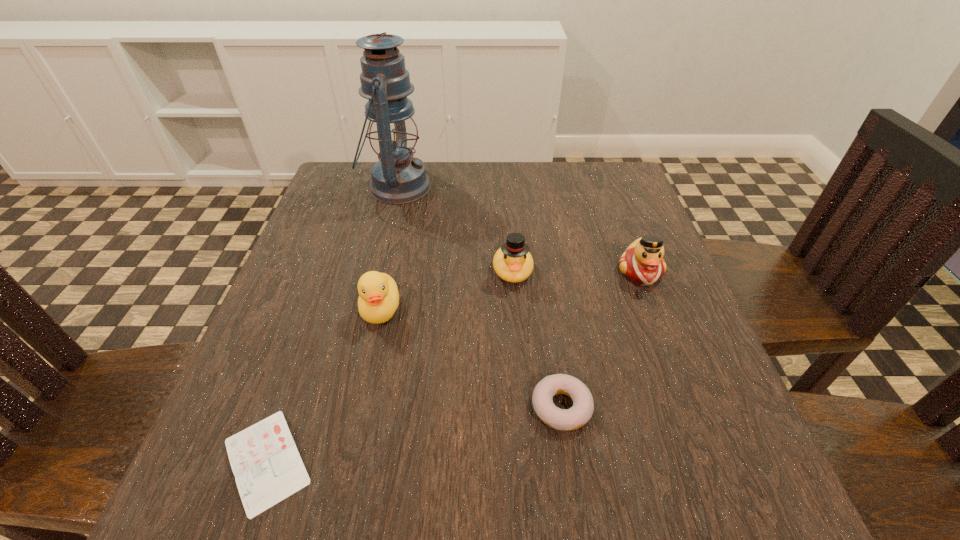
Where is `the farthest object`? This screenshot has width=960, height=540. the farthest object is located at coordinates pyautogui.click(x=398, y=178).

Identify the location of lantern. (398, 178).

Where is `the second duck from left to right`? the second duck from left to right is located at coordinates (512, 262).

Find the location of `the rightmost object`. the rightmost object is located at coordinates (642, 263).

Identify the location of the leftmost duck. (378, 300).

Locate an element on the screen. the fifth tallest object is located at coordinates (579, 414).

Identify the location of diary. The width and height of the screenshot is (960, 540). (267, 466).

At what (x,y) coordinates should I click in order to perform the action: click on vacant space located on the front-facing side of the farthest object. Please return your answer as a coordinate pair (x, y). Looking at the image, I should click on (521, 187).

Locate an element on the screen. This screenshot has height=540, width=960. vacant position located 0.120m on the front-facing side of the second duck from right to left is located at coordinates (518, 341).

Where is `free spot located on the face of the rightmost duck`? The image size is (960, 540). free spot located on the face of the rightmost duck is located at coordinates (679, 374).